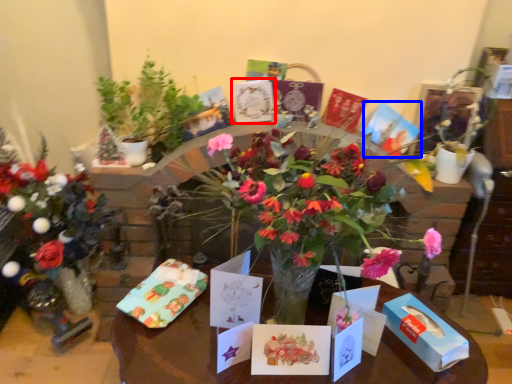
Question: Which of the following is the closest to the observer, birthday card (highlighted by a red box) or birthday card (highlighted by a blue box)?

Choices:
 (A) birthday card
 (B) birthday card

Answer: (A)